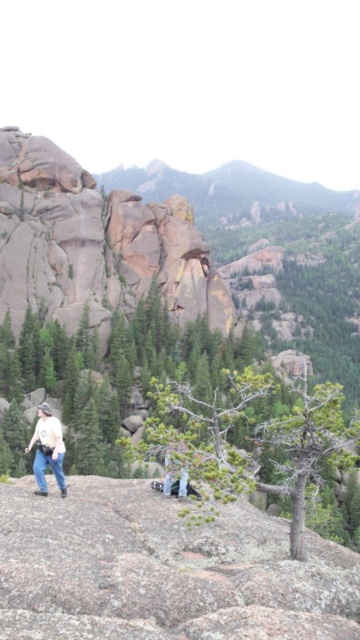
You are standing at the point marked by the coordinates point (x=249, y=440). Looking around, you see the green matte tree at center. Which direction should you face to see the rocky outcrop with the two hikers?

You should face towards the direction opposite of the green matte tree at center to see the rocky outcrop with the two hikers, as the hikers are located in the foreground while the tree is at the center of the image.

You are a hiker trying to navigate through the rocky terrain. You see the green matte tree at center and the light beige shirt at lower left. Which object is positioned to the right of the other?

The green matte tree at center is to the right of the light beige shirt at lower left.

You are a hiker trying to navigate through the rocky terrain. You notice a green matte tree at center and a light beige shirt at lower left. Which object takes up more horizontal space in the scene?

The green matte tree at center takes up more horizontal space than the light beige shirt at lower left because its width is larger.